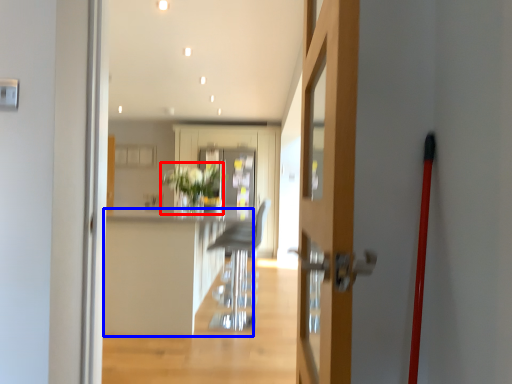
Question: Which object appears farthest to the camera in this image, plant (highlighted by a red box) or counter top (highlighted by a blue box)?

Choices:
 (A) plant
 (B) counter top

Answer: (A)